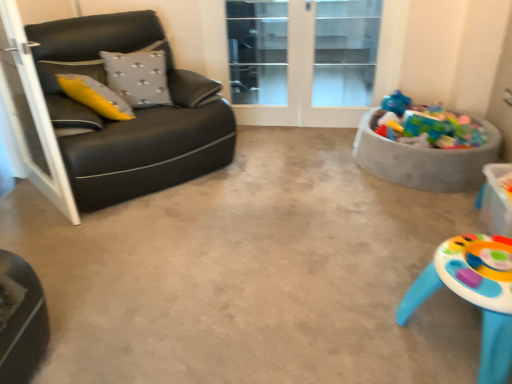
Image resolution: width=512 pixels, height=384 pixels. Find the location of `vacant region to the left of plastic colorful toys at right`. vacant region to the left of plastic colorful toys at right is located at coordinates (321, 160).